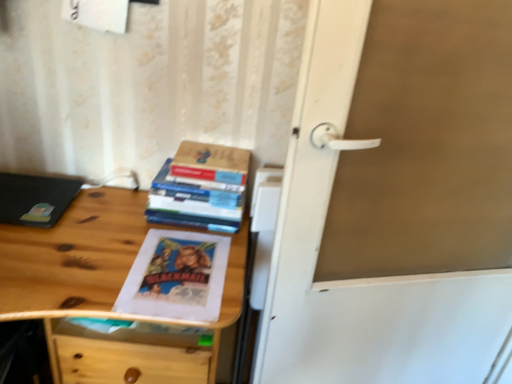
Question: Can you confirm if white matte door handle at center is taller than hardcover books at center?

Choices:
 (A) yes
 (B) no

Answer: (A)

Question: Is white matte door handle at center at the left side of hardcover books at center?

Choices:
 (A) yes
 (B) no

Answer: (B)

Question: Can you confirm if white matte door handle at center is bigger than hardcover books at center?

Choices:
 (A) no
 (B) yes

Answer: (B)

Question: Can you confirm if white matte door handle at center is thinner than hardcover books at center?

Choices:
 (A) no
 (B) yes

Answer: (B)

Question: From a real-world perspective, is white matte door handle at center over hardcover books at center?

Choices:
 (A) yes
 (B) no

Answer: (B)

Question: Considering the relative sizes of white matte door handle at center and hardcover books at center in the image provided, is white matte door handle at center shorter than hardcover books at center?

Choices:
 (A) no
 (B) yes

Answer: (A)

Question: Would you say hardcover book at upper center is a long distance from hardcover books at center?

Choices:
 (A) yes
 (B) no

Answer: (B)

Question: Considering the relative sizes of hardcover book at upper center and hardcover books at center in the image provided, is hardcover book at upper center bigger than hardcover books at center?

Choices:
 (A) no
 (B) yes

Answer: (A)

Question: Is hardcover book at upper center facing away from hardcover books at center?

Choices:
 (A) yes
 (B) no

Answer: (B)

Question: Can you confirm if hardcover book at upper center is taller than hardcover books at center?

Choices:
 (A) yes
 (B) no

Answer: (B)

Question: From a real-world perspective, is hardcover book at upper center physically below hardcover books at center?

Choices:
 (A) yes
 (B) no

Answer: (B)

Question: Does hardcover book at upper center have a smaller size compared to hardcover books at center?

Choices:
 (A) yes
 (B) no

Answer: (A)

Question: From a real-world perspective, is hardcover book at upper center over white matte door handle at center?

Choices:
 (A) no
 (B) yes

Answer: (B)